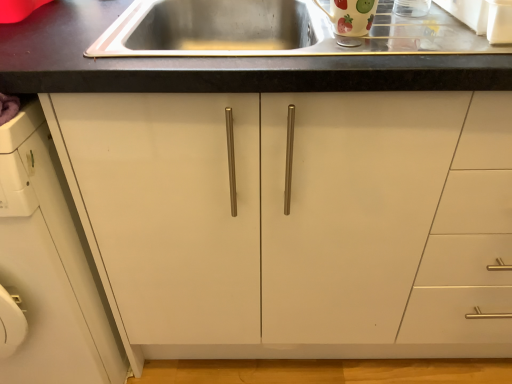
Question: Is white matte cabinet at left wider or thinner than glossy ceramic mug at upper center?

Choices:
 (A) wide
 (B) thin

Answer: (A)

Question: Choose the correct answer: Is white matte cabinet at left inside glossy ceramic mug at upper center or outside it?

Choices:
 (A) outside
 (B) inside

Answer: (A)

Question: Relative to glossy ceramic mug at upper center, is white matte cabinet at left in front or behind?

Choices:
 (A) behind
 (B) front

Answer: (B)

Question: Is glossy ceramic mug at upper center spatially inside white matte cabinet at left, or outside of it?

Choices:
 (A) inside
 (B) outside

Answer: (B)

Question: Based on their positions, is glossy ceramic mug at upper center located to the left or right of white matte cabinet at left?

Choices:
 (A) right
 (B) left

Answer: (A)

Question: Is glossy ceramic mug at upper center wider or thinner than white matte cabinet at left?

Choices:
 (A) thin
 (B) wide

Answer: (A)

Question: Does point (364, 3) appear closer or farther from the camera than point (53, 307)?

Choices:
 (A) closer
 (B) farther

Answer: (A)